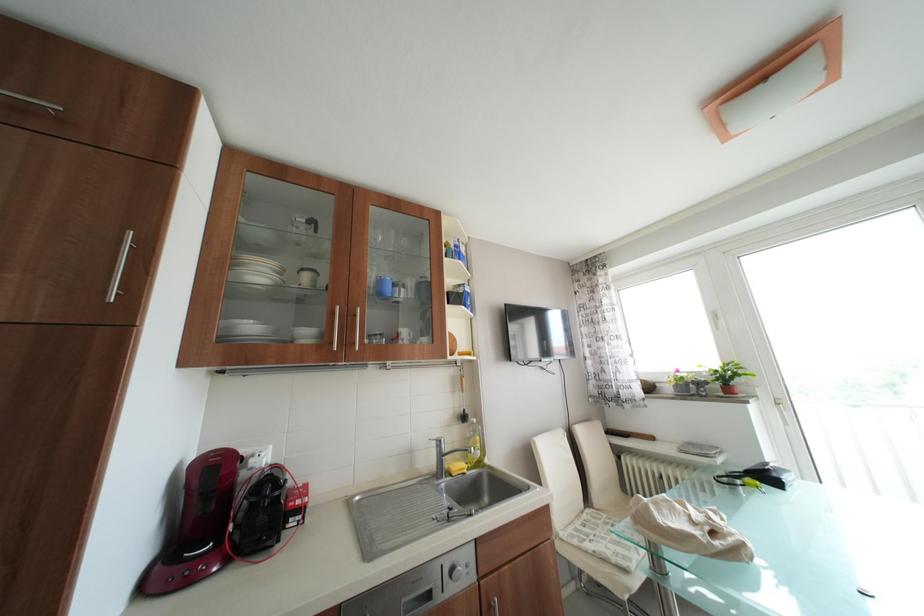
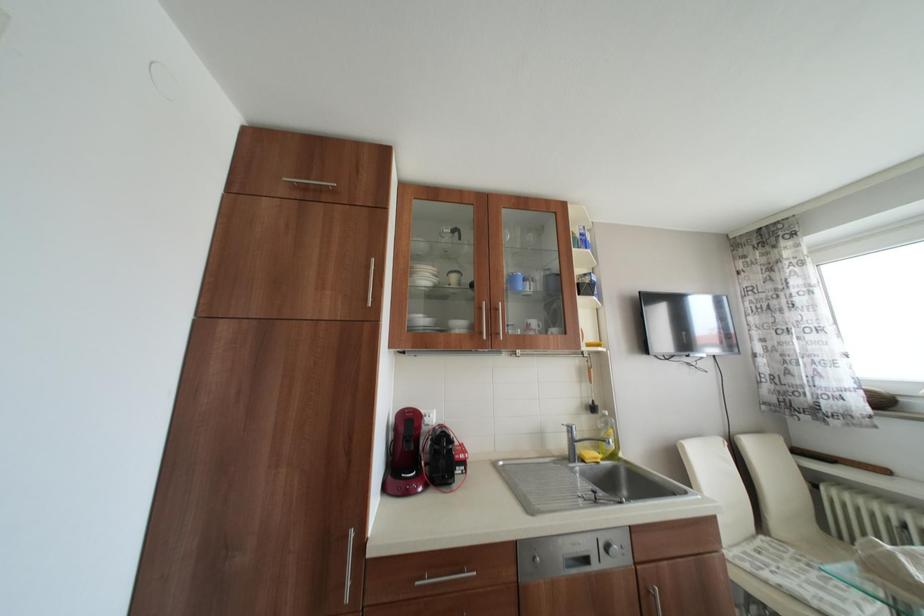
Question: The camera is either moving clockwise (left) or counter-clockwise (right) around the object. The first image is from the beginning of the video and the second image is from the end. Is the camera moving left or right when shooting the video?

Choices:
 (A) Left
 (B) Right

Answer: (B)